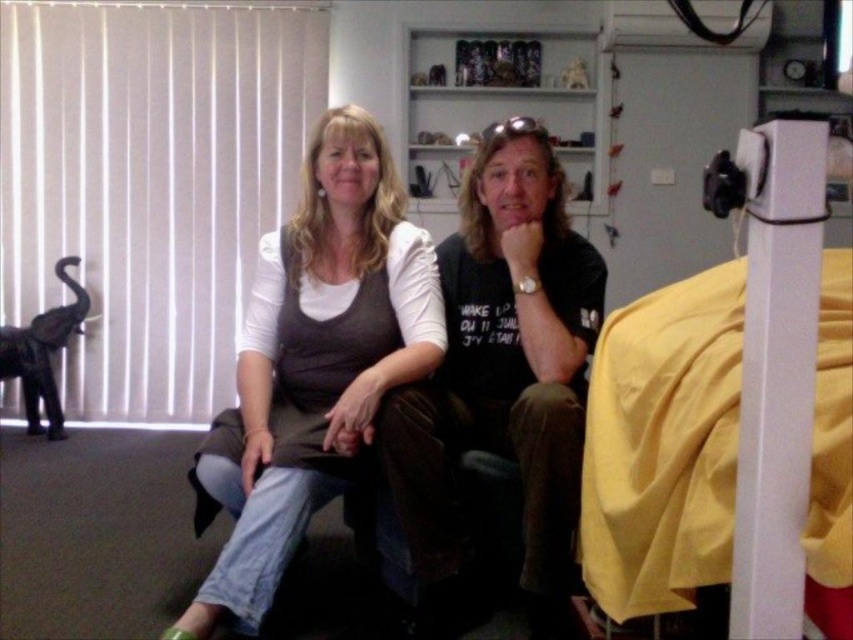
You are standing in the room and want to place a small decoration between the two points, point (279, 540) and point (558, 556). Which point should the decoration be closer to in order to appear larger from your current viewpoint?

The decoration should be placed closer to point (279, 540) because it is closer to the camera, making objects placed there appear larger from your viewpoint.

In the scene shown: You are designing a layout for a small bedroom and need to place both the yellow fabric bed at right and the matte gray sweater at center. Given their sizes, which object should be placed closer to the entrance to maximize space efficiency?

The yellow fabric bed at right is smaller than the matte gray sweater at center. To maximize space efficiency, place the larger matte gray sweater at center closer to the entrance so it can be easily accessed without blocking the smaller bed.